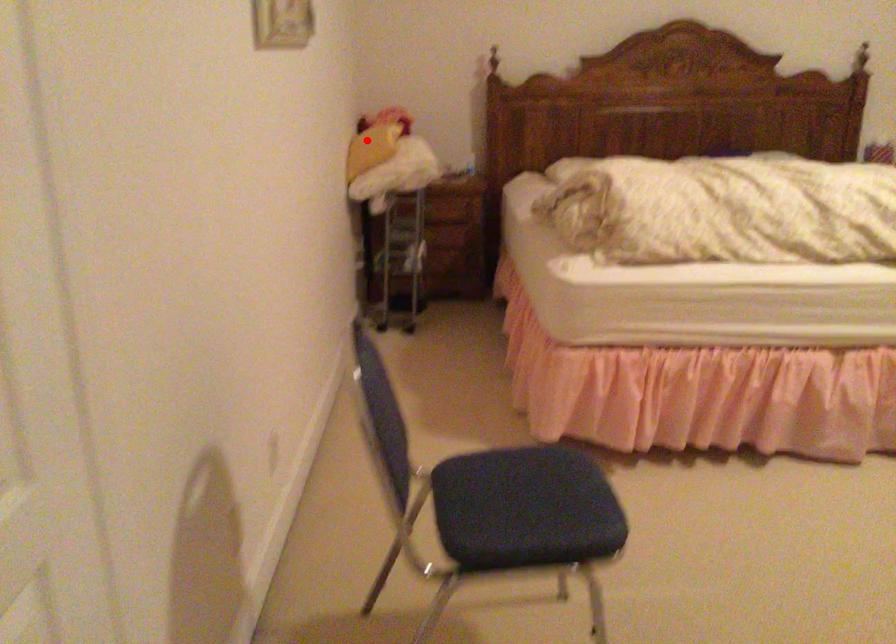
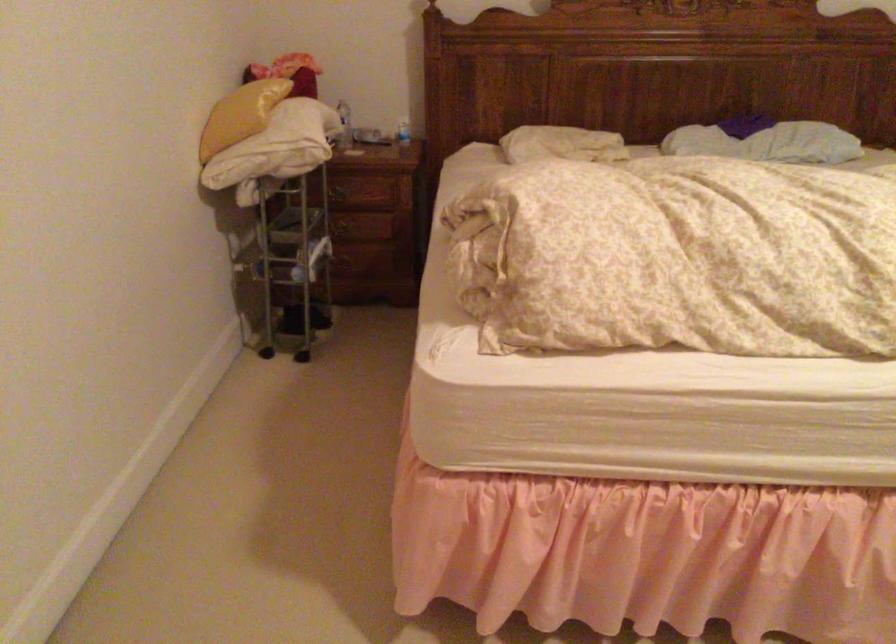
Find the pixel in the second image that matches the highlighted location in the first image.

(240, 115)